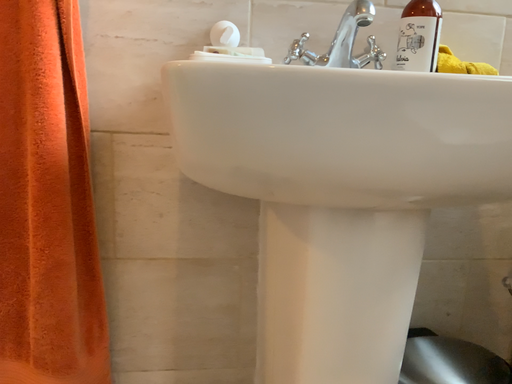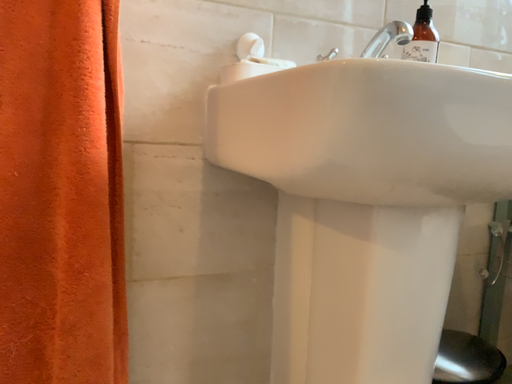
Question: How did the camera likely rotate when shooting the video?

Choices:
 (A) rotated right
 (B) rotated left

Answer: (A)